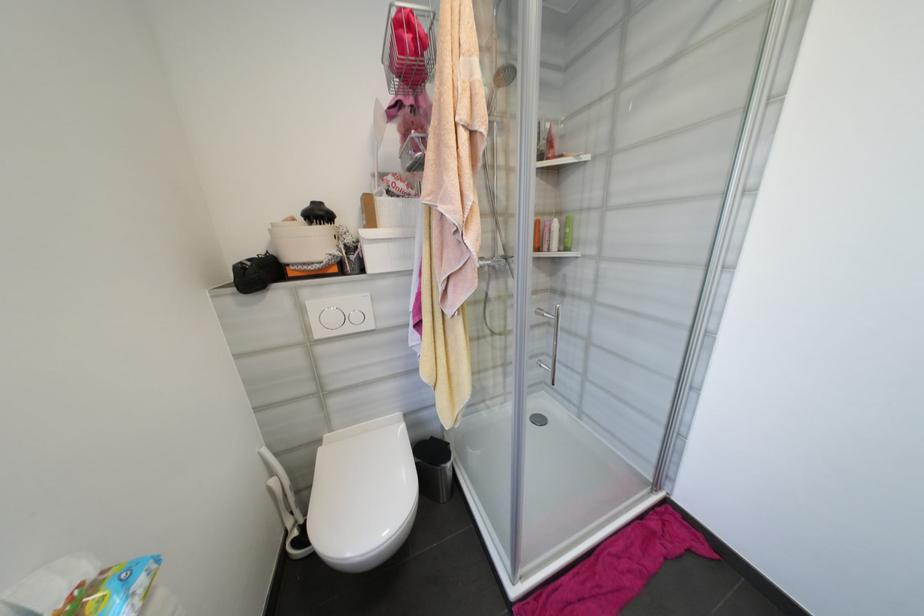
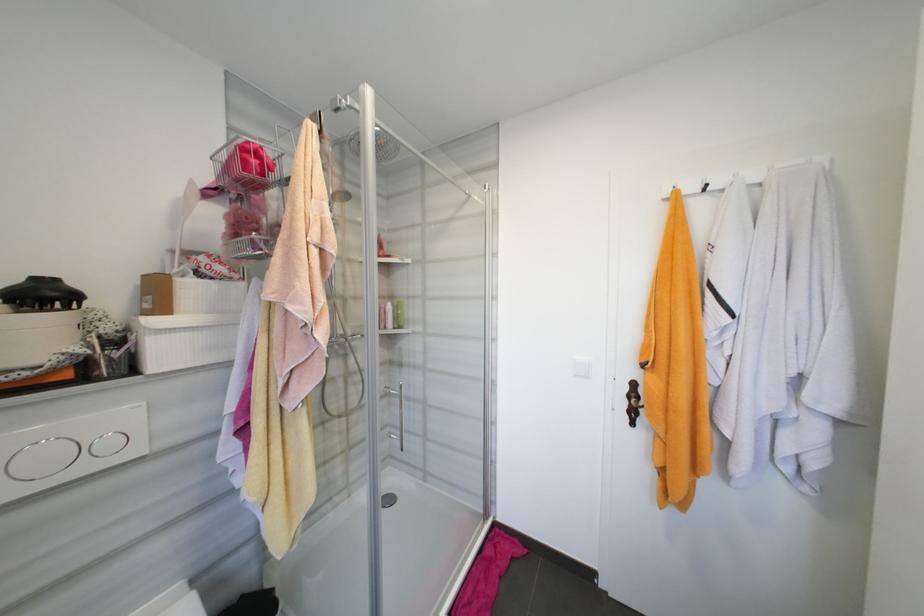
Question: Based on the continuous images, in which direction is the camera rotating? Reply with the corresponding letter.

Choices:
 (A) Left
 (B) Right
 (C) Up
 (D) Down

Answer: (B)